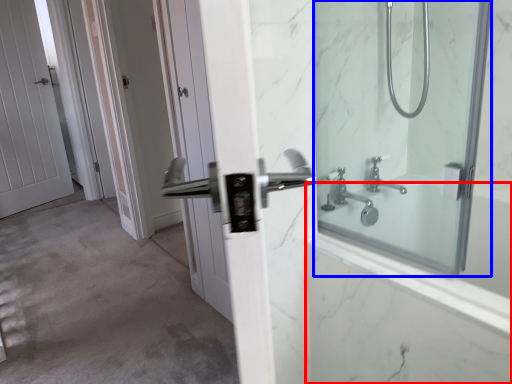
Question: Which object appears closest to the camera in this image, bath (highlighted by a red box) or mirror (highlighted by a blue box)?

Choices:
 (A) bath
 (B) mirror

Answer: (B)